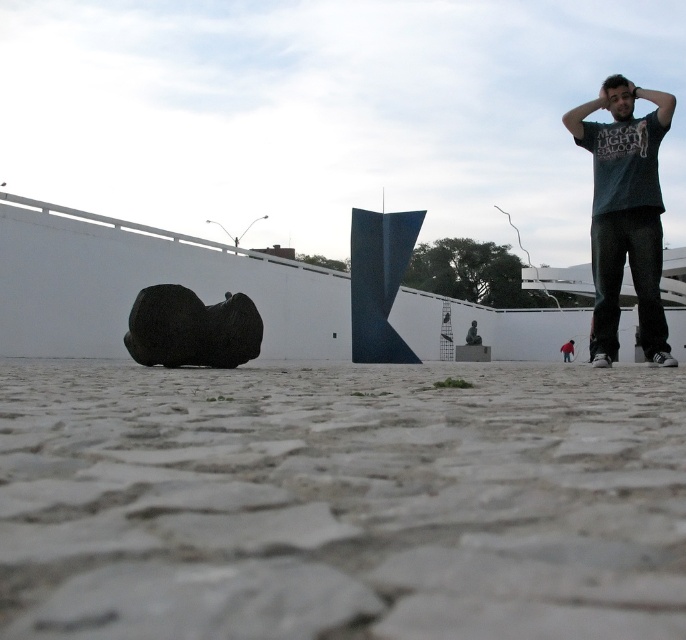
You are standing at the entrance of the urban area and want to reach the cobblestone pavement at lower center. According to the coordinates provided, where should you look to find it?

The cobblestone pavement at lower center is located at coordinates point [340,500].